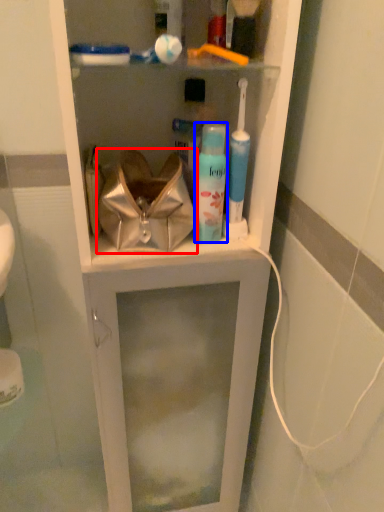
Question: Which object is closer to the camera taking this photo, handbag (highlighted by a red box) or toiletry (highlighted by a blue box)?

Choices:
 (A) handbag
 (B) toiletry

Answer: (A)